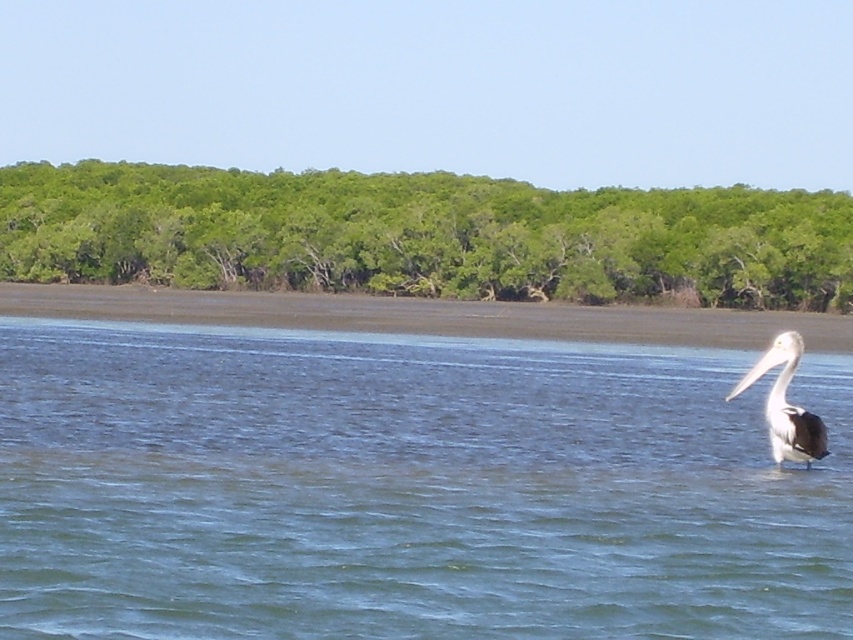
Question: Is blue water at center wider than green leafy trees at upper center?

Choices:
 (A) no
 (B) yes

Answer: (A)

Question: Which object appears closest to the camera in this image?

Choices:
 (A) blue water at center
 (B) white matte pelican at right
 (C) green leafy trees at upper center

Answer: (A)

Question: Is blue water at center to the left of green leafy trees at upper center from the viewer's perspective?

Choices:
 (A) yes
 (B) no

Answer: (B)

Question: Observing the image, what is the correct spatial positioning of blue water at center in reference to green leafy trees at upper center?

Choices:
 (A) below
 (B) above

Answer: (A)

Question: Which object is farther from the camera taking this photo?

Choices:
 (A) blue water at center
 (B) white matte pelican at right

Answer: (B)

Question: Among these objects, which one is farthest from the camera?

Choices:
 (A) white matte pelican at right
 (B) blue water at center
 (C) green leafy trees at upper center

Answer: (C)